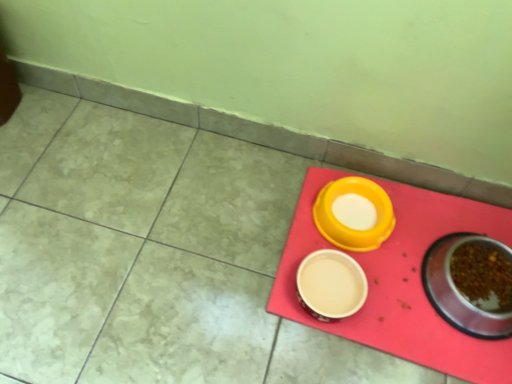
Question: Should I look upward or downward to see yellow plastic bowl at center, which appears as the 2th tableware when viewed from the left?

Choices:
 (A) down
 (B) up

Answer: (A)

Question: Would you say metallic stainless steel bowl at lower right, the third tableware positioned from the left, is part of rubberized red tray at lower right's contents?

Choices:
 (A) no
 (B) yes

Answer: (A)

Question: Can you confirm if rubberized red tray at lower right is positioned to the right of metallic stainless steel bowl at lower right, the third tableware positioned from the left?

Choices:
 (A) no
 (B) yes

Answer: (A)

Question: Does rubberized red tray at lower right have a smaller size compared to metallic stainless steel bowl at lower right, the third tableware positioned from the left?

Choices:
 (A) no
 (B) yes

Answer: (B)

Question: Can you confirm if rubberized red tray at lower right is positioned to the left of metallic stainless steel bowl at lower right, the third tableware positioned from the left?

Choices:
 (A) no
 (B) yes

Answer: (B)

Question: Can you confirm if rubberized red tray at lower right is wider than metallic stainless steel bowl at lower right, the third tableware positioned from the left?

Choices:
 (A) no
 (B) yes

Answer: (B)

Question: Does rubberized red tray at lower right have a greater height compared to metallic stainless steel bowl at lower right, which is counted as the first tableware, starting from the right?

Choices:
 (A) yes
 (B) no

Answer: (B)

Question: Is beige ceramic bowl at center, the first tableware in the left-to-right sequence, positioned in front of rubberized red tray at lower right?

Choices:
 (A) no
 (B) yes

Answer: (A)

Question: Does beige ceramic bowl at center, the first tableware in the left-to-right sequence, have a lesser height compared to rubberized red tray at lower right?

Choices:
 (A) yes
 (B) no

Answer: (B)

Question: From a real-world perspective, is beige ceramic bowl at center, placed as the 3th tableware when sorted from right to left, physically below rubberized red tray at lower right?

Choices:
 (A) no
 (B) yes

Answer: (A)

Question: Does beige ceramic bowl at center, placed as the 3th tableware when sorted from right to left, have a lesser width compared to rubberized red tray at lower right?

Choices:
 (A) yes
 (B) no

Answer: (A)

Question: From the image's perspective, does beige ceramic bowl at center, placed as the 3th tableware when sorted from right to left, appear higher than rubberized red tray at lower right?

Choices:
 (A) yes
 (B) no

Answer: (B)

Question: Is beige ceramic bowl at center, placed as the 3th tableware when sorted from right to left, bigger than rubberized red tray at lower right?

Choices:
 (A) no
 (B) yes

Answer: (A)

Question: From the image's perspective, would you say beige ceramic bowl at center, the first tableware in the left-to-right sequence, is shown under metallic stainless steel bowl at lower right, which is counted as the first tableware, starting from the right?

Choices:
 (A) no
 (B) yes

Answer: (B)